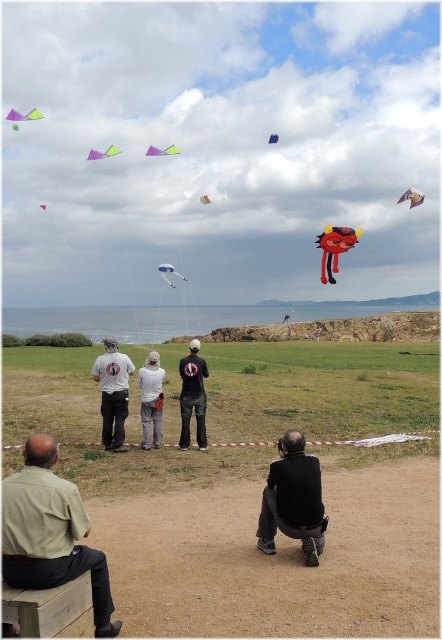
Can you confirm if red glossy kite at center is positioned to the right of white glossy kite at center?

Correct, you'll find red glossy kite at center to the right of white glossy kite at center.

Is red glossy kite at center thinner than white glossy kite at center?

Indeed, red glossy kite at center has a lesser width compared to white glossy kite at center.

Where is `red glossy kite at center`? red glossy kite at center is located at coordinates (335, 248).

Who is positioned more to the right, white cotton shirt at center or white glossy kite at upper center?

white cotton shirt at center is more to the right.

In the scene shown: Is white cotton shirt at center further to camera compared to white glossy kite at upper center?

That is False.

Who is more distant from viewer, (160, 435) or (204, 202)?

Point (204, 202)

The image size is (442, 640). I want to click on white cotton shirt at center, so click(151, 401).

Which of these two, white glossy kite at center or purple matte kite at upper left, stands taller?

With more height is purple matte kite at upper left.

Between point (171, 268) and point (110, 145), which one is positioned in front?

Point (171, 268) is in front.

The image size is (442, 640). Find the location of `white glossy kite at center`. white glossy kite at center is located at coordinates (168, 273).